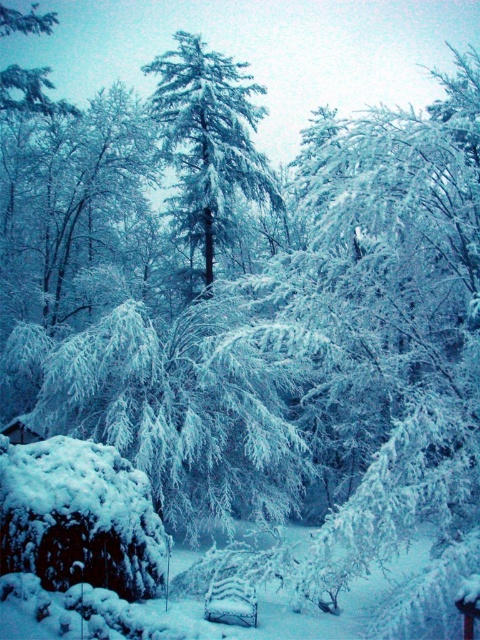
Question: Is snow-covered pine tree at center to the right of white snow-covered bench at lower center from the viewer's perspective?

Choices:
 (A) no
 (B) yes

Answer: (A)

Question: Does snow-covered pine tree at center appear under white snow-covered bench at lower center?

Choices:
 (A) no
 (B) yes

Answer: (A)

Question: Observing the image, what is the correct spatial positioning of snow-covered pine tree at center in reference to white snow-covered bench at lower center?

Choices:
 (A) left
 (B) right

Answer: (A)

Question: Which point appears farthest from the camera in this image?

Choices:
 (A) (203, 90)
 (B) (223, 612)

Answer: (A)